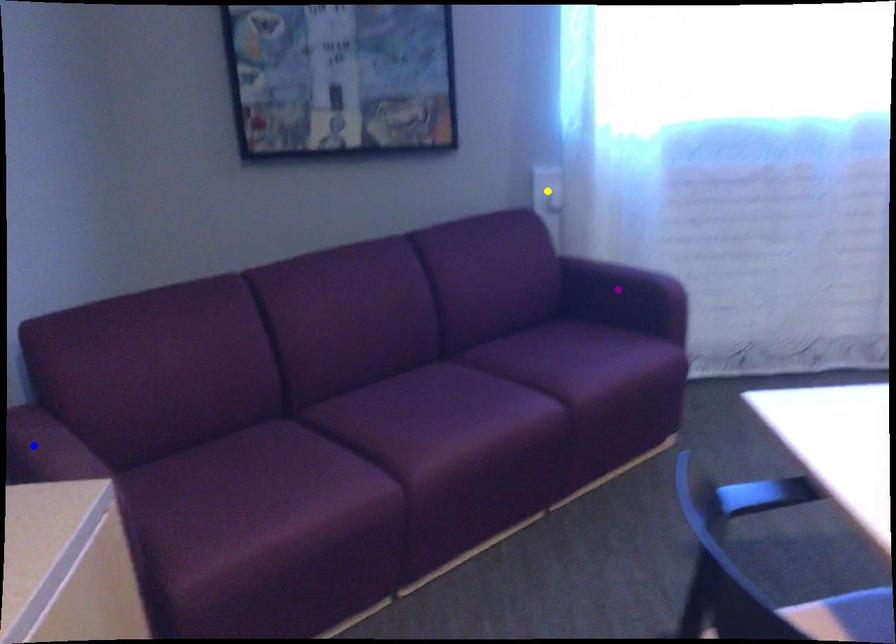
Order these from farthest to nearest:
- blue point
- purple point
- yellow point

yellow point < purple point < blue point